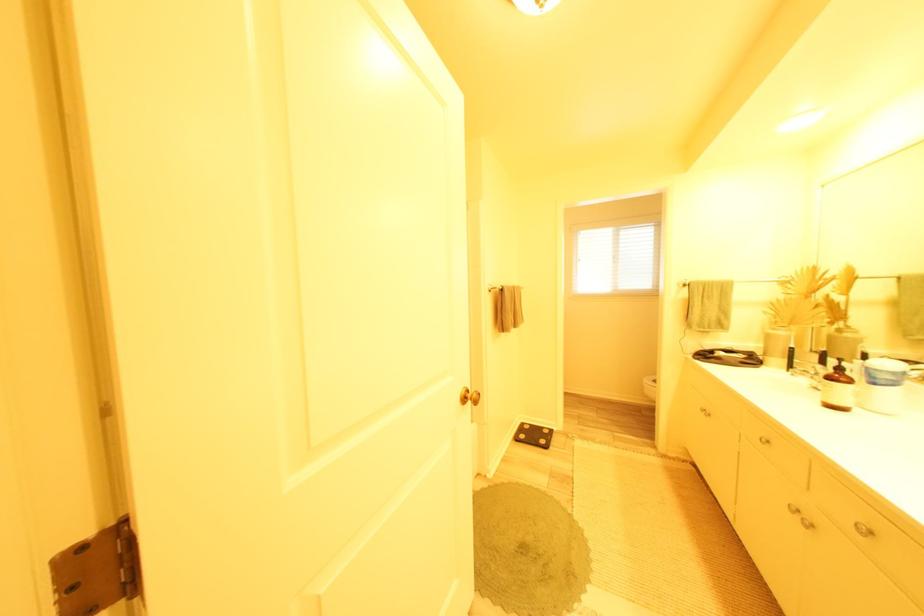
This screenshot has height=616, width=924. What are the coordinates of `faucet handle` in the screenshot? It's located at point(808,373).